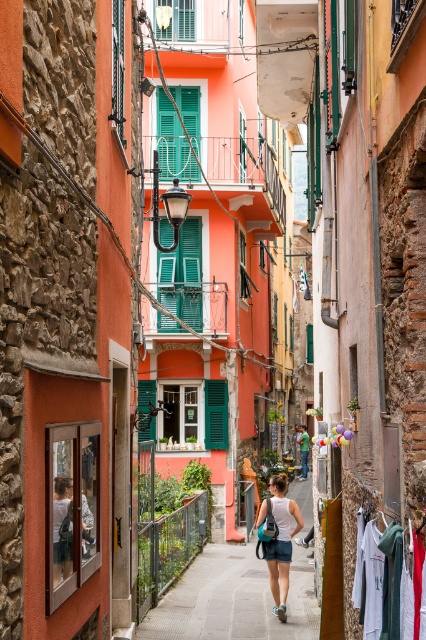
Does point (236, 593) lie behind point (279, 600)?

Yes.

Which is behind, point (206, 625) or point (276, 612)?

The point (276, 612) is behind.

Identify the location of gray concrete pavement at center. (233, 600).

Can you confirm if green matte shutter at center is shorter than white fabric skirt at center?

Incorrect, green matte shutter at center's height does not fall short of white fabric skirt at center's.

Locate an element on the screen. The height and width of the screenshot is (640, 426). green matte shutter at center is located at coordinates (183, 275).

Does point (380, 600) come behind point (167, 128)?

No, (380, 600) is in front of (167, 128).

The width and height of the screenshot is (426, 640). I want to click on white cotton shirt at lower right, so click(383, 582).